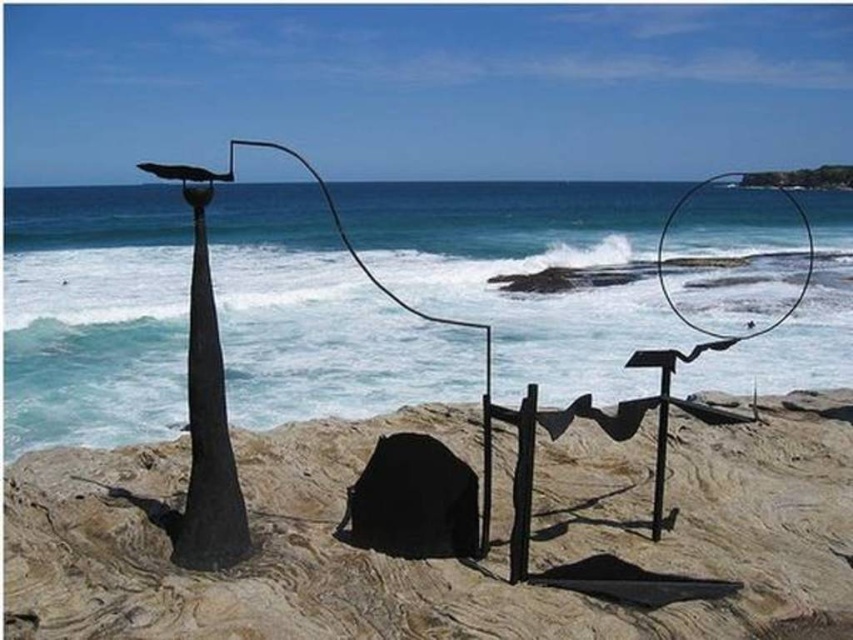
The image size is (853, 640). Describe the element at coordinates (447, 560) in the screenshot. I see `smooth sand at center` at that location.

The width and height of the screenshot is (853, 640). I want to click on smooth sand at center, so click(447, 560).